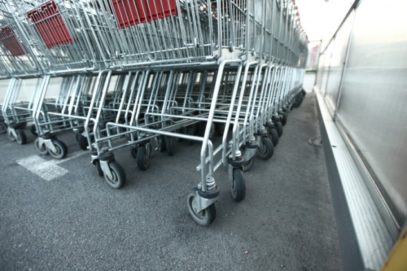
Find the location of a particular element. This screenshot has height=271, width=407. 3rd seating area for child is located at coordinates (10, 50).